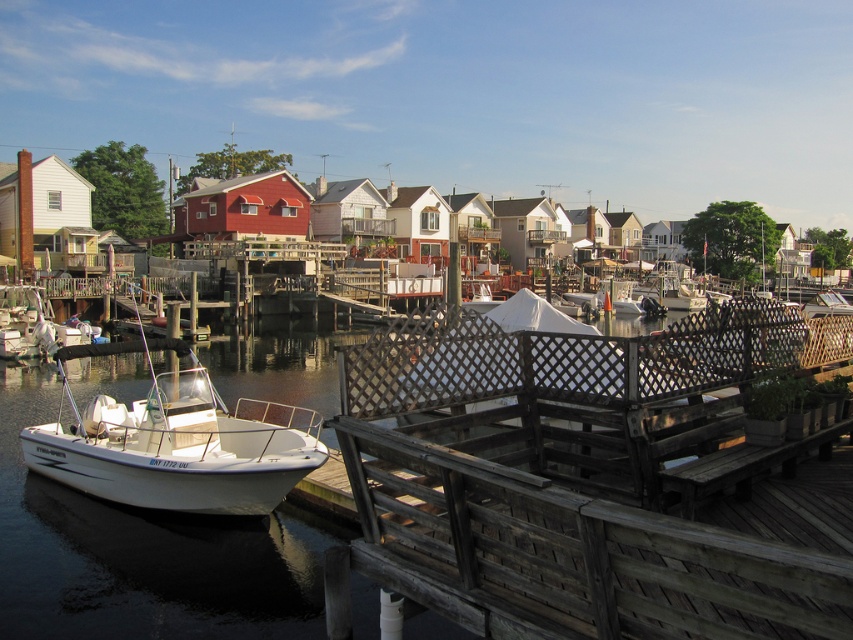
You are standing on the wooden dock at center and want to board the white matte boat at lower left. Which direction should you move to reach the boat?

Since the wooden dock at center is closer to you than the white matte boat at lower left, you should move forward along the dock towards the boat to reach it.

You are standing on the wooden dock at center and want to move to the white matte boat at lower left. Which direction should you walk to reach the boat?

You should walk to the left because the wooden dock at center is to the right of the white matte boat at lower left.

You are a delivery drone with a wingspan of 1.5 meters. You need to fly from the wooden dock at center to the white matte boat at lower left. Is there enough space between them for your drone to pass safely?

The wooden dock at center and the white matte boat at lower left are 9.93 meters apart from each other, which is more than enough space for a drone with a 1.5 meter wingspan to pass safely between them.